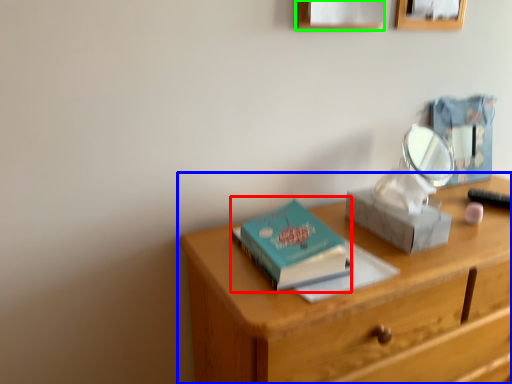
Question: Which object is positioned farthest from paperback book (highlighted by a red box)? Select from desk (highlighted by a blue box) and picture frame (highlighted by a green box).

Choices:
 (A) desk
 (B) picture frame

Answer: (B)